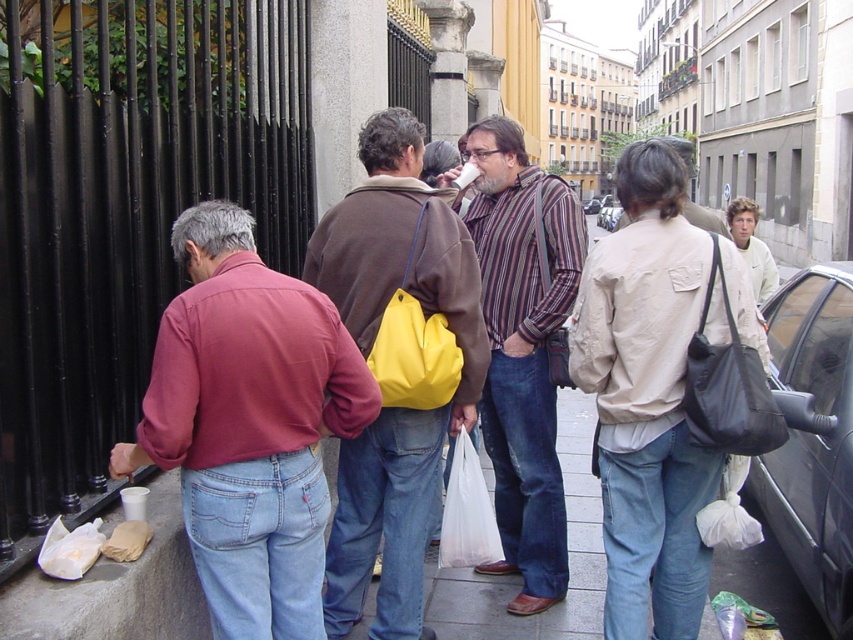
What do you see at coordinates (811, 436) in the screenshot? Image resolution: width=853 pixels, height=640 pixels. I see `black glossy car at right` at bounding box center [811, 436].

Can you confirm if black glossy car at right is positioned above white fleece jacket at upper right?

Incorrect, black glossy car at right is not positioned above white fleece jacket at upper right.

The image size is (853, 640). In order to click on black glossy car at right in this screenshot , I will do click(x=811, y=436).

Can you confirm if matte red shirt at left is smaller than white fleece jacket at upper right?

Correct, matte red shirt at left occupies less space than white fleece jacket at upper right.

Does matte red shirt at left appear under white fleece jacket at upper right?

Indeed, matte red shirt at left is positioned under white fleece jacket at upper right.

Between point (306, 586) and point (741, 196), which one is positioned behind?

Point (741, 196)

What are the coordinates of `matte red shirt at left` in the screenshot? It's located at (248, 422).

Locate an element on the screen. black glossy car at right is located at coordinates (811, 436).

Can you confirm if black glossy car at right is shorter than black leather bag at right?

Incorrect, black glossy car at right's height does not fall short of black leather bag at right's.

Does point (834, 442) lie behind point (685, 384)?

That is True.

Image resolution: width=853 pixels, height=640 pixels. Find the location of `black glossy car at right`. black glossy car at right is located at coordinates (811, 436).